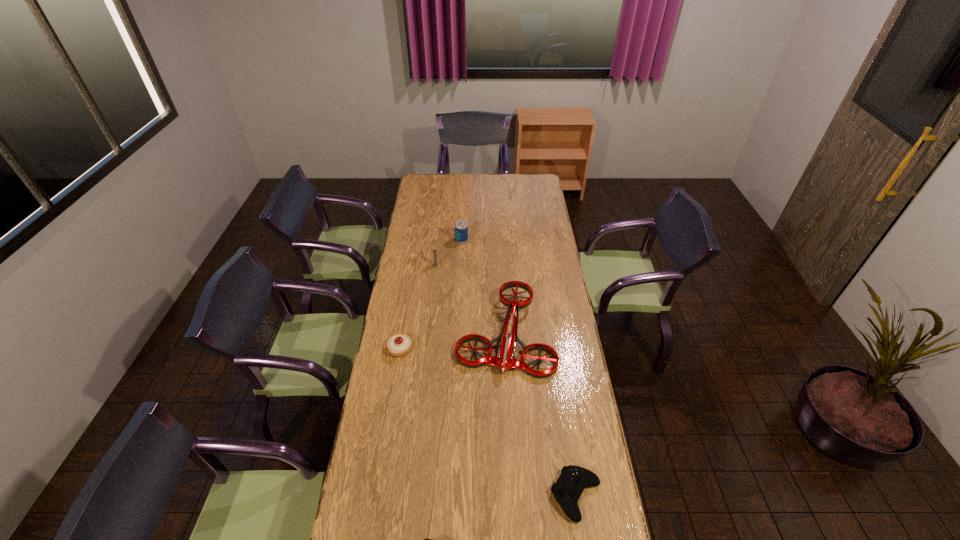
Find the location of `empty location between the pastry and the igniter`. empty location between the pastry and the igniter is located at coordinates (418, 307).

Locate an element on the screen. The width and height of the screenshot is (960, 540). free space between the fifth nearest object and the farthest object is located at coordinates (449, 253).

You are a GUI agent. You are given a task and a screenshot of the screen. Output one action in this format:
    pyautogui.click(x=<x>, y=<y>)
    Task: Click on the blank region between the farthest object and the third shortest object
    Image resolution: width=960 pixels, height=540 pixels.
    Given the screenshot: What is the action you would take?
    pyautogui.click(x=431, y=295)

Locate an element on the screen. vacant space that's between the pastry and the beer can is located at coordinates (431, 295).

Identify the location of free space between the fifth object from right to left and the third shortest object. (418, 307).

At what (x,y) coordinates should I click in order to perform the action: click on vacant space in between the igniter and the control. Please return your answer as a coordinate pair (x, y). This screenshot has height=540, width=960. Looking at the image, I should click on (506, 380).

Select which object appears as the second closest to the farthest object. Please provide its 2D coordinates. Your answer should be formatted as a tuple, i.e. [(x, y)], where the tuple contains the x and y coordinates of a point satisfying the conditions above.

[(505, 359)]

This screenshot has height=540, width=960. What are the coordinates of `object that is the fifth closest one to the nearest object` in the screenshot? It's located at (461, 227).

The width and height of the screenshot is (960, 540). I want to click on blank space that satisfies the following two spatial constraints: 1. on the back side of the pastry; 2. on the left side of the drone, so click(403, 332).

Identify the location of vacant region that satisfies the following two spatial constraints: 1. on the back side of the pastry; 2. on the right side of the second farthest object. (414, 265).